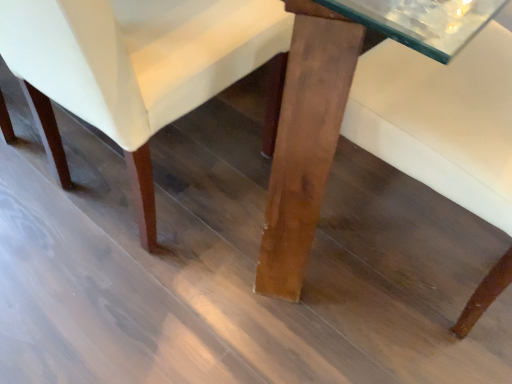
This screenshot has height=384, width=512. Describe the element at coordinates (134, 67) in the screenshot. I see `matte wood chair at center` at that location.

In order to click on matte wood chair at center in this screenshot , I will do `click(134, 67)`.

What is the approximate height of matte wood chair at center?

matte wood chair at center is 29.05 inches in height.

Measure the distance between wooden table at center and camera.

A distance of 64.15 centimeters exists between wooden table at center and camera.

The image size is (512, 384). What do you see at coordinates (303, 138) in the screenshot?
I see `wooden table at center` at bounding box center [303, 138].

Locate an element on the screen. The width and height of the screenshot is (512, 384). wooden table at center is located at coordinates (303, 138).

Find the location of `matte wood chair at center`. matte wood chair at center is located at coordinates (134, 67).

Is matte wood chair at center to the left or to the right of wooden table at center in the image?

Based on their positions, matte wood chair at center is located to the left of wooden table at center.

Considering the positions of objects matte wood chair at center and wooden table at center in the image provided, who is in front, matte wood chair at center or wooden table at center?

wooden table at center is in front.

Does point (148, 134) come in front of point (328, 56)?

That is False.

From the image's perspective, is matte wood chair at center on wooden table at center?

Yes, from the image's perspective, matte wood chair at center is over wooden table at center.

From a real-world perspective, which object stands above the other?

matte wood chair at center, from a real-world perspective.

Looking at this image, is matte wood chair at center wider than wooden table at center?

No.

From their relative heights in the image, would you say matte wood chair at center is taller or shorter than wooden table at center?

matte wood chair at center is taller than wooden table at center.

Does matte wood chair at center have a larger size compared to wooden table at center?

Yes, matte wood chair at center is bigger than wooden table at center.

Is matte wood chair at center surrounding wooden table at center?

No, wooden table at center is not surrounded by matte wood chair at center.

Is the surface of matte wood chair at center in direct contact with wooden table at center?

No, matte wood chair at center is not touching wooden table at center.

Is matte wood chair at center oriented away from wooden table at center?

No, matte wood chair at center is not facing the opposite direction of wooden table at center.

How different are the orientations of matte wood chair at center and wooden table at center in degrees?

matte wood chair at center and wooden table at center are facing 85.3 degrees away from each other.

Where is `chair on the left of wooden table at center`? chair on the left of wooden table at center is located at coordinates (134, 67).

Between wooden table at center and matte wood chair at center, which one appears on the left side from the viewer's perspective?

Positioned to the left is matte wood chair at center.

Is the position of wooden table at center less distant than that of matte wood chair at center?

Yes, wooden table at center is closer to the camera.

Is point (307, 135) farther from viewer compared to point (0, 35)?

That is True.

From the image's perspective, is wooden table at center positioned above or below matte wood chair at center?

Clearly, from the image's perspective, wooden table at center is below matte wood chair at center.

From a real-world perspective, is wooden table at center on matte wood chair at center?

No, from a real-world perspective, wooden table at center is not over matte wood chair at center

Is wooden table at center thinner than matte wood chair at center?

In fact, wooden table at center might be wider than matte wood chair at center.

Between wooden table at center and matte wood chair at center, which one has less height?

With less height is wooden table at center.

Considering the relative sizes of wooden table at center and matte wood chair at center in the image provided, is wooden table at center smaller than matte wood chair at center?

Yes, wooden table at center is smaller than matte wood chair at center.

In the scene shown: Is wooden table at center inside the boundaries of matte wood chair at center, or outside?

wooden table at center is outside matte wood chair at center.

Is wooden table at center far away from matte wood chair at center?

No, wooden table at center is not far from matte wood chair at center.

Is wooden table at center positioned with its back to matte wood chair at center?

No, wooden table at center is not facing the opposite direction of matte wood chair at center.

This screenshot has height=384, width=512. I want to click on chair lying above the wooden table at center (from the image's perspective), so click(x=134, y=67).

The width and height of the screenshot is (512, 384). What are the coordinates of `chair behind the wooden table at center` in the screenshot? It's located at (134, 67).

This screenshot has width=512, height=384. In the image, there is a matte wood chair at center. What are the coordinates of `table below it (from the image's perspective)` in the screenshot? It's located at (x=303, y=138).